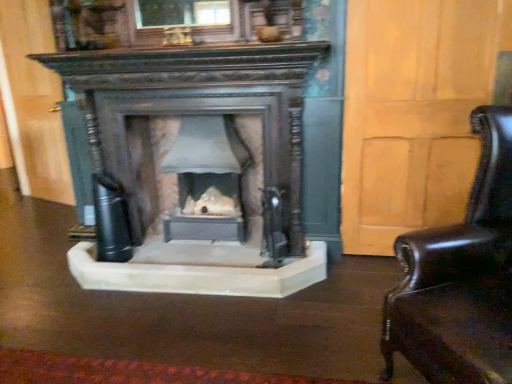
What do you see at coordinates (207, 180) in the screenshot?
I see `matte gray stone fireplace at center` at bounding box center [207, 180].

Where is `matte gray stone fireplace at center`? matte gray stone fireplace at center is located at coordinates (207, 180).

Where is `shiny black leather swivel chair at right`? Image resolution: width=512 pixels, height=384 pixels. shiny black leather swivel chair at right is located at coordinates (460, 277).

The height and width of the screenshot is (384, 512). Describe the element at coordinates (460, 277) in the screenshot. I see `shiny black leather swivel chair at right` at that location.

What is the approximate height of shiny black leather swivel chair at right?

1.06 meters.

This screenshot has width=512, height=384. I want to click on matte gray stone fireplace at center, so click(207, 180).

Which object is positioned more to the right, matte gray stone fireplace at center or shiny black leather swivel chair at right?

Positioned to the right is shiny black leather swivel chair at right.

Considering the positions of objects matte gray stone fireplace at center and shiny black leather swivel chair at right in the image provided, who is in front, matte gray stone fireplace at center or shiny black leather swivel chair at right?

shiny black leather swivel chair at right.

Considering the positions of points (206, 146) and (451, 253), is point (206, 146) closer to camera compared to point (451, 253)?

No, (206, 146) is behind (451, 253).

From the image's perspective, is matte gray stone fireplace at center over shiny black leather swivel chair at right?

Yes.

From a real-world perspective, does matte gray stone fireplace at center sit lower than shiny black leather swivel chair at right?

Yes, from a real-world perspective, matte gray stone fireplace at center is below shiny black leather swivel chair at right.

Can you confirm if matte gray stone fireplace at center is thinner than shiny black leather swivel chair at right?

Yes, matte gray stone fireplace at center is thinner than shiny black leather swivel chair at right.

Is matte gray stone fireplace at center shorter than shiny black leather swivel chair at right?

Indeed, matte gray stone fireplace at center has a lesser height compared to shiny black leather swivel chair at right.

Considering the relative sizes of matte gray stone fireplace at center and shiny black leather swivel chair at right in the image provided, is matte gray stone fireplace at center smaller than shiny black leather swivel chair at right?

Correct, matte gray stone fireplace at center occupies less space than shiny black leather swivel chair at right.

Is matte gray stone fireplace at center situated inside shiny black leather swivel chair at right or outside?

matte gray stone fireplace at center is not enclosed by shiny black leather swivel chair at right.

Is matte gray stone fireplace at center not close to shiny black leather swivel chair at right?

That's right, there is a large distance between matte gray stone fireplace at center and shiny black leather swivel chair at right.

Is matte gray stone fireplace at center positioned with its back to shiny black leather swivel chair at right?

No, matte gray stone fireplace at center is not facing the opposite direction of shiny black leather swivel chair at right.

The width and height of the screenshot is (512, 384). In order to click on swivel chair located below the matte gray stone fireplace at center (from the image's perspective) in this screenshot , I will do `click(460, 277)`.

Does shiny black leather swivel chair at right appear on the right side of matte gray stone fireplace at center?

Correct, you'll find shiny black leather swivel chair at right to the right of matte gray stone fireplace at center.

Relative to matte gray stone fireplace at center, is shiny black leather swivel chair at right in front or behind?

Clearly, shiny black leather swivel chair at right is in front of matte gray stone fireplace at center.

Which is nearer, (511, 146) or (229, 229)?

Point (511, 146).

From the image's perspective, which object appears higher, shiny black leather swivel chair at right or matte gray stone fireplace at center?

matte gray stone fireplace at center appears higher in the image.

From a real-world perspective, between shiny black leather swivel chair at right and matte gray stone fireplace at center, who is vertically higher?

shiny black leather swivel chair at right.

Can you confirm if shiny black leather swivel chair at right is thinner than matte gray stone fireplace at center?

→ Incorrect, the width of shiny black leather swivel chair at right is not less than that of matte gray stone fireplace at center.

In the scene shown: Can you confirm if shiny black leather swivel chair at right is shorter than matte gray stone fireplace at center?

No.

Is shiny black leather swivel chair at right bigger than matte gray stone fireplace at center?

Yes, shiny black leather swivel chair at right is bigger than matte gray stone fireplace at center.

Would you say matte gray stone fireplace at center is part of shiny black leather swivel chair at right's contents?

No, matte gray stone fireplace at center is not surrounded by shiny black leather swivel chair at right.

Would you say shiny black leather swivel chair at right is a long distance from matte gray stone fireplace at center?

Indeed, shiny black leather swivel chair at right is not near matte gray stone fireplace at center.

Could you tell me if shiny black leather swivel chair at right is turned towards matte gray stone fireplace at center?

No, shiny black leather swivel chair at right is not aimed at matte gray stone fireplace at center.

Image resolution: width=512 pixels, height=384 pixels. Find the location of `fireplace on the left of the shiny black leather swivel chair at right`. fireplace on the left of the shiny black leather swivel chair at right is located at coordinates (207, 180).

This screenshot has height=384, width=512. Identify the location of fireplace lying on the left of shiny black leather swivel chair at right. (207, 180).

At what (x,y) coordinates should I click in order to perform the action: click on swivel chair on the right of matte gray stone fireplace at center. Please return your answer as a coordinate pair (x, y). Image resolution: width=512 pixels, height=384 pixels. Looking at the image, I should click on (460, 277).